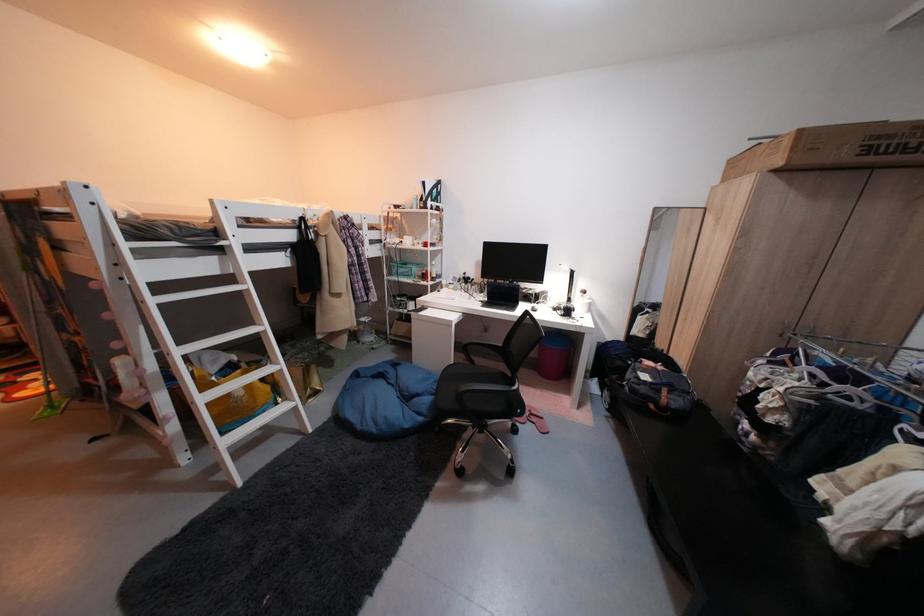
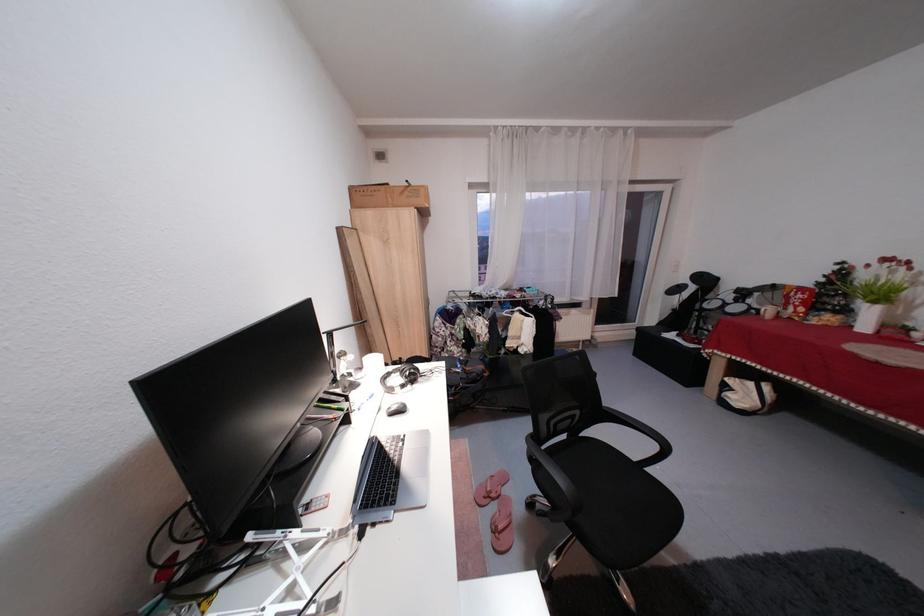
Locate, in the second image, the point that corresponds to the point at 787,139 in the first image.

(420, 185)